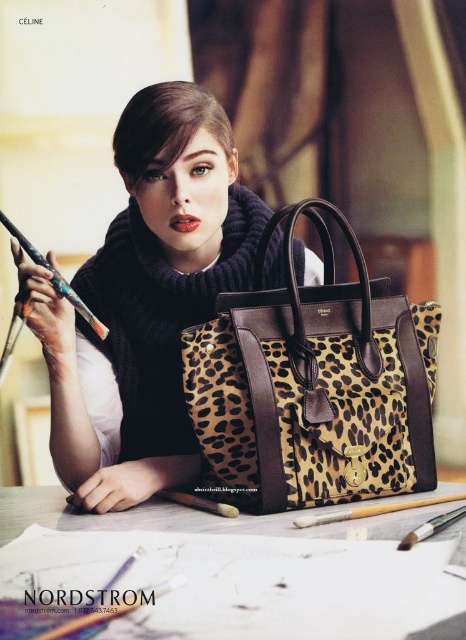
Question: Is leather table at center further to camera compared to wooden pencil at upper left?

Choices:
 (A) no
 (B) yes

Answer: (A)

Question: Which of these objects is positioned closest to the leopard print fabric tote bag at center?

Choices:
 (A) wooden pencil at upper left
 (B) leather table at center
 (C) matte black sweater at center

Answer: (B)

Question: Which point appears closest to the camera in this image?

Choices:
 (A) (75, 524)
 (B) (368, 276)

Answer: (A)

Question: Does matte black sweater at center have a larger size compared to wooden pencil at upper left?

Choices:
 (A) no
 (B) yes

Answer: (B)

Question: Does matte black sweater at center appear on the right side of leopard print fabric tote bag at center?

Choices:
 (A) no
 (B) yes

Answer: (A)

Question: Among these points, which one is farthest from the camera?

Choices:
 (A) (117, 275)
 (B) (341, 321)
 (C) (76, 301)

Answer: (A)